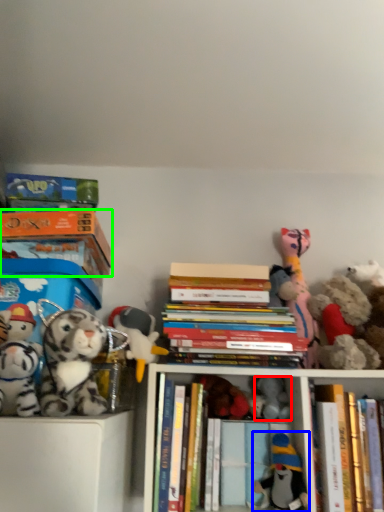
Question: Which object is positioned closest to toy (highlighted by a red box)? Select from toy (highlighted by a blue box) and book (highlighted by a green box).

Choices:
 (A) toy
 (B) book

Answer: (A)